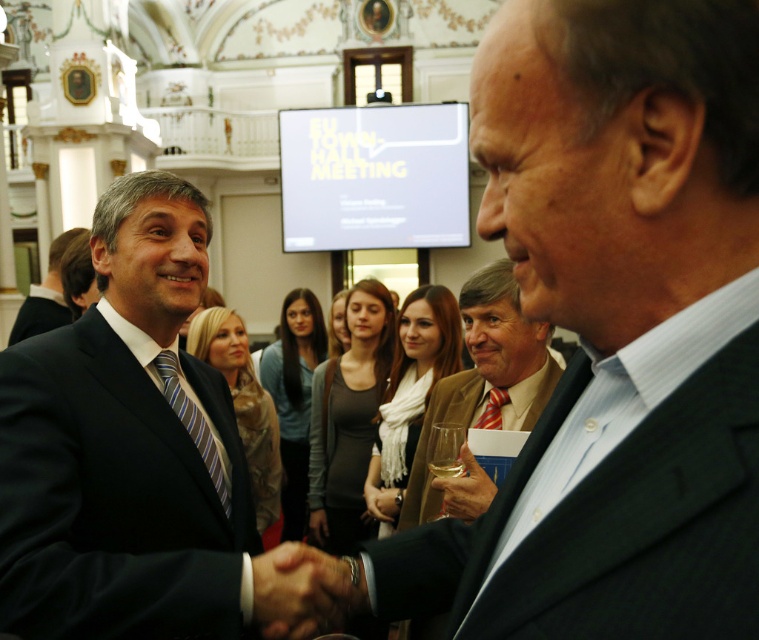
You are a photographer at the EU Town Hall Meeting. You need to capture a photo of the smooth leather hand at center and the translucent glass at right. Can you focus on both objects clearly in the same photo?

A: The smooth leather hand at center is in front of the translucent glass at right, so focusing on both clearly might be challenging due to their different distances from the camera.